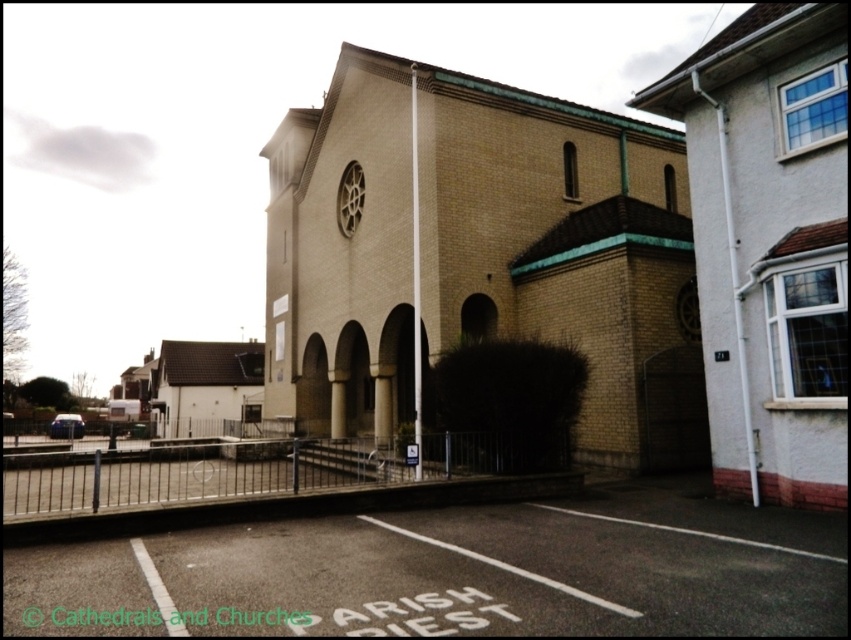
Is point (400, 346) less distant than point (511, 512)?

That is False.

The width and height of the screenshot is (851, 640). In order to click on beige brick church at center in this screenshot , I will do `click(478, 253)`.

Does point (380, 307) come in front of point (614, 570)?

No, it is not.

At what (x,y) coordinates should I click in order to perform the action: click on beige brick church at center. Please return your answer as a coordinate pair (x, y). The width and height of the screenshot is (851, 640). Looking at the image, I should click on (478, 253).

Is dark asphalt parking lot at lower center taller than matte brick church at right?

No, dark asphalt parking lot at lower center is not taller than matte brick church at right.

How far apart are dark asphalt parking lot at lower center and matte brick church at right?

6.80 meters

Does point (429, 630) come closer to viewer compared to point (741, 461)?

Yes, it is in front of point (741, 461).

Identify the location of dark asphalt parking lot at lower center. 455,573.

Is point (501, 330) behind point (726, 460)?

Yes, it is.

This screenshot has height=640, width=851. I want to click on beige brick church at center, so click(x=478, y=253).

What are the coordinates of `beige brick church at center` in the screenshot? It's located at (478, 253).